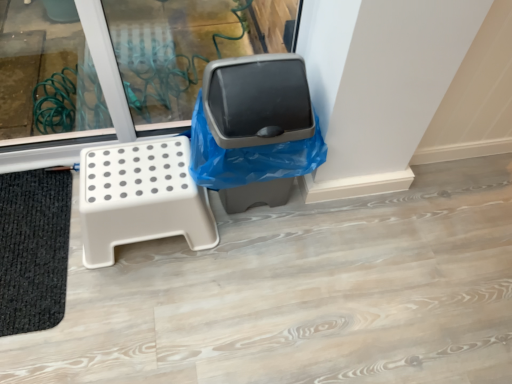
Question: Considering the relative sizes of white plastic stool at left and matte plastic trash can at center in the image provided, is white plastic stool at left taller than matte plastic trash can at center?

Choices:
 (A) yes
 (B) no

Answer: (B)

Question: Is white plastic stool at left facing towards matte plastic trash can at center?

Choices:
 (A) no
 (B) yes

Answer: (A)

Question: Considering the relative sizes of white plastic stool at left and matte plastic trash can at center in the image provided, is white plastic stool at left thinner than matte plastic trash can at center?

Choices:
 (A) no
 (B) yes

Answer: (A)

Question: From a real-world perspective, does white plastic stool at left sit lower than matte plastic trash can at center?

Choices:
 (A) no
 (B) yes

Answer: (B)

Question: Would you consider white plastic stool at left to be distant from matte plastic trash can at center?

Choices:
 (A) yes
 (B) no

Answer: (B)

Question: From the image's perspective, is white plastic stool at left on matte plastic trash can at center?

Choices:
 (A) yes
 (B) no

Answer: (B)

Question: Can you confirm if matte plastic trash can at center is taller than white plastic stool at left?

Choices:
 (A) yes
 (B) no

Answer: (A)

Question: Is matte plastic trash can at center smaller than white plastic stool at left?

Choices:
 (A) yes
 (B) no

Answer: (B)

Question: Can you see matte plastic trash can at center touching white plastic stool at left?

Choices:
 (A) no
 (B) yes

Answer: (A)

Question: From the image's perspective, is matte plastic trash can at center over white plastic stool at left?

Choices:
 (A) no
 (B) yes

Answer: (B)

Question: Are matte plastic trash can at center and white plastic stool at left located far from each other?

Choices:
 (A) no
 (B) yes

Answer: (A)

Question: Does matte plastic trash can at center have a greater width compared to white plastic stool at left?

Choices:
 (A) no
 (B) yes

Answer: (A)

Question: From the image's perspective, is matte plastic trash can at center on black textured bath mat at lower left?

Choices:
 (A) no
 (B) yes

Answer: (B)